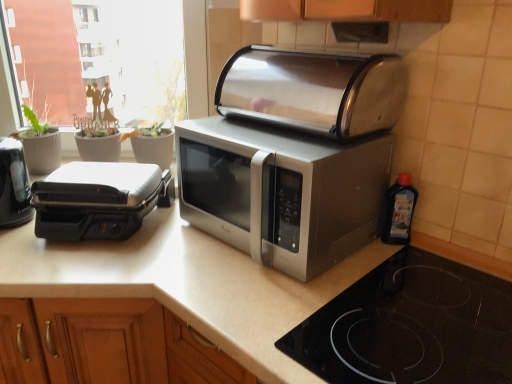
The height and width of the screenshot is (384, 512). I want to click on vacant area that is in front of satin silver microwave at center, so click(x=307, y=311).